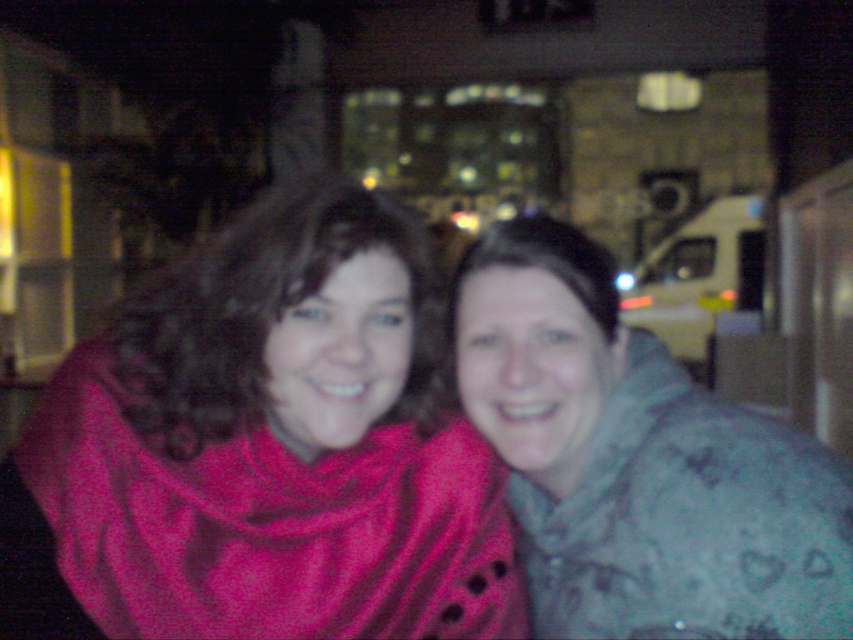
Question: Is matte red scarf at left positioned before gray fuzzy jacket at center?

Choices:
 (A) no
 (B) yes

Answer: (B)

Question: Considering the relative positions of matte red scarf at left and gray fuzzy jacket at center in the image provided, where is matte red scarf at left located with respect to gray fuzzy jacket at center?

Choices:
 (A) right
 (B) left

Answer: (B)

Question: Among these points, which one is farthest from the camera?

Choices:
 (A) (753, 548)
 (B) (154, 285)

Answer: (B)

Question: Where is matte red scarf at left located in relation to gray fuzzy jacket at center in the image?

Choices:
 (A) right
 (B) left

Answer: (B)

Question: Which of the following is the farthest from the observer?

Choices:
 (A) matte red scarf at left
 (B) gray fuzzy jacket at center

Answer: (B)

Question: Which point appears farthest from the camera in this image?

Choices:
 (A) (245, 598)
 (B) (782, 573)

Answer: (A)